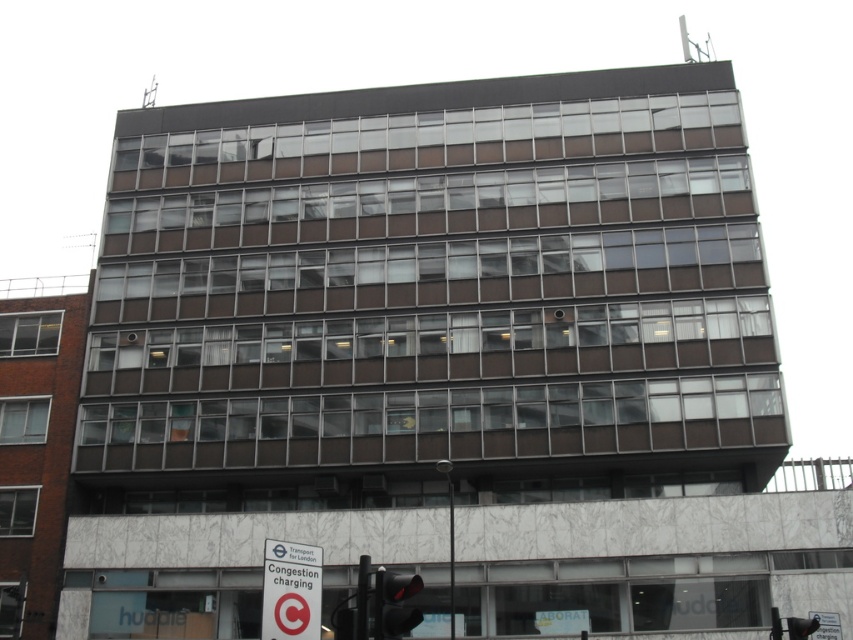
Does white plastic sign at lower center appear on the left side of red glass traffic light at lower center?

Indeed, white plastic sign at lower center is positioned on the left side of red glass traffic light at lower center.

Which is above, white plastic sign at lower center or red glass traffic light at lower center?

Positioned higher is red glass traffic light at lower center.

Who is more forward, (x=297, y=612) or (x=405, y=620)?

Point (x=405, y=620) is more forward.

Locate an element on the screen. The height and width of the screenshot is (640, 853). white plastic sign at lower center is located at coordinates (291, 589).